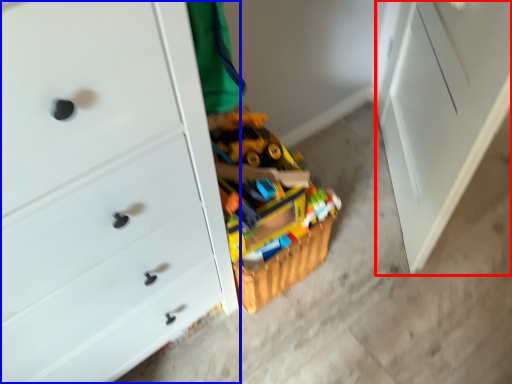
Question: Which point is closer to the camera, file cabinet (highlighted by a red box) or chest of drawers (highlighted by a blue box)?

Choices:
 (A) file cabinet
 (B) chest of drawers

Answer: (B)